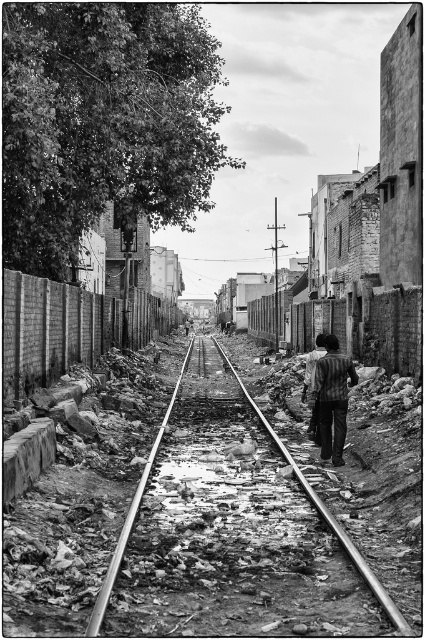
Question: Can you confirm if smooth metal track at center is bigger than striped shirt at center?

Choices:
 (A) no
 (B) yes

Answer: (B)

Question: Is smooth metal track at center further to the viewer compared to striped shirt at center?

Choices:
 (A) yes
 (B) no

Answer: (B)

Question: Which point is closer to the camera taking this photo?

Choices:
 (A) (320, 404)
 (B) (351, 547)

Answer: (B)

Question: Which of the following is the farthest from the observer?

Choices:
 (A) (95, 602)
 (B) (343, 428)

Answer: (B)

Question: Which point appears closest to the camera in this image?

Choices:
 (A) (333, 404)
 (B) (212, 336)

Answer: (A)

Question: Does smooth metal track at center lie behind striped shirt at center?

Choices:
 (A) no
 (B) yes

Answer: (A)